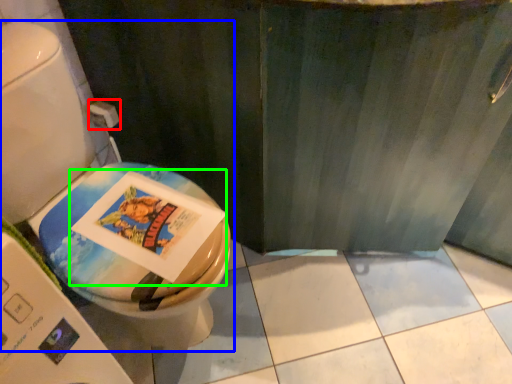
Question: Which is nearer to the toilet paper (highlighted by a red box)? toilet (highlighted by a blue box) or comic book (highlighted by a green box).

Choices:
 (A) toilet
 (B) comic book

Answer: (A)